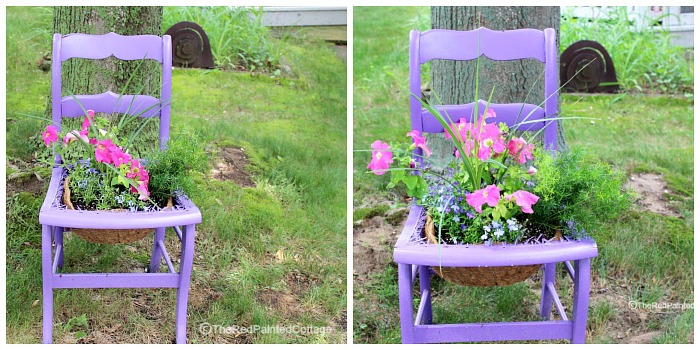
Locate an element on the screen. This screenshot has width=700, height=350. window is located at coordinates (584, 6).